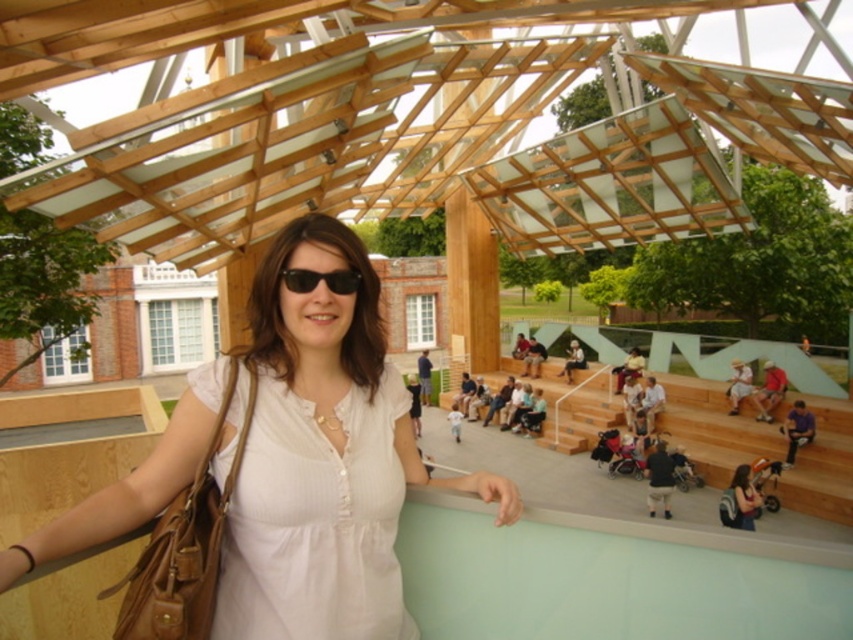
Which is behind, point (267, 397) or point (740, 508)?

Positioned behind is point (740, 508).

Does point (94, 540) come farther from viewer compared to point (758, 490)?

No, it is not.

This screenshot has height=640, width=853. I want to click on white matte dress at center, so click(273, 474).

Between point (755, 508) and point (294, 285), which one is positioned in front?

Point (294, 285)

Does matte brown backpack at lower right appear over black matte sunglasses at center?

Incorrect, matte brown backpack at lower right is not positioned above black matte sunglasses at center.

Is point (730, 509) farther from camera compared to point (305, 291)?

Yes, it is.

Identify the location of matte brown backpack at lower right. This screenshot has height=640, width=853. (740, 500).

Is white matte dress at center bigger than black matte sunglasses at center?

Indeed, white matte dress at center has a larger size compared to black matte sunglasses at center.

Between white matte dress at center and black matte sunglasses at center, which one appears on the right side from the viewer's perspective?

From the viewer's perspective, black matte sunglasses at center appears more on the right side.

Who is more distant from viewer, (132, 596) or (341, 273)?

The point (341, 273) is more distant.

This screenshot has width=853, height=640. What are the coordinates of `white matte dress at center` in the screenshot? It's located at (273, 474).